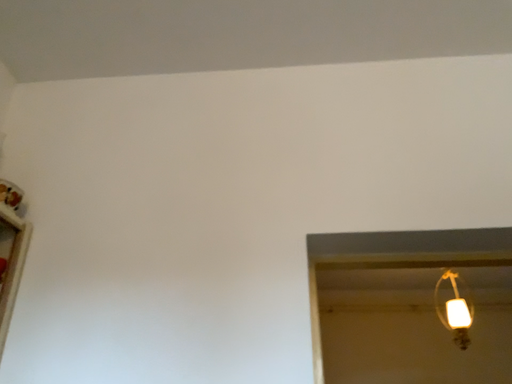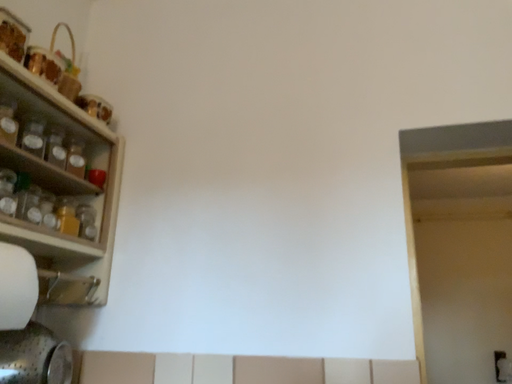
Question: How did the camera likely rotate when shooting the video?

Choices:
 (A) rotated right
 (B) rotated left

Answer: (B)